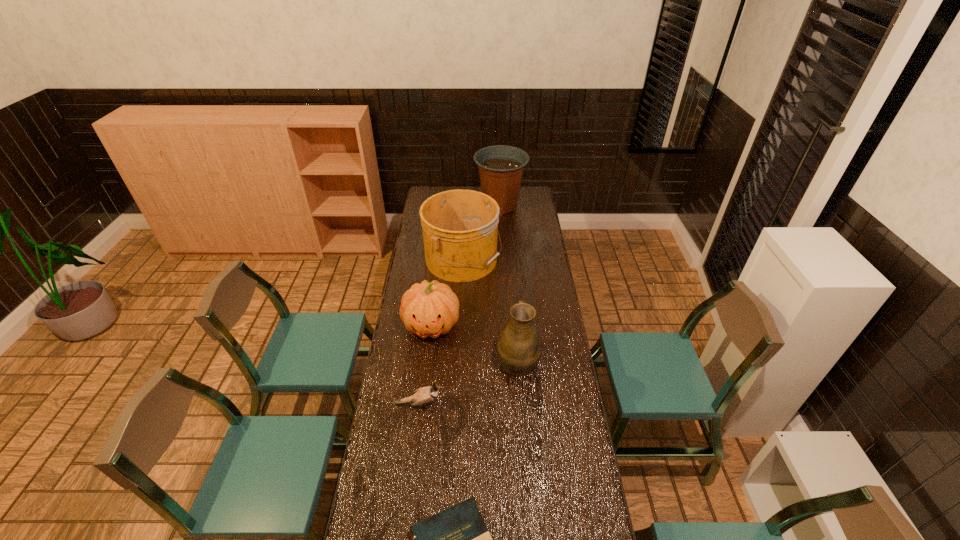
Image resolution: width=960 pixels, height=540 pixels. In order to click on vacant point at the left edge in this screenshot , I will do `click(421, 239)`.

Identify the location of free spot at the right edge of the desktop. (519, 225).

You are a GUI agent. You are given a task and a screenshot of the screen. Output one action in this format:
    pyautogui.click(x=<x>, y=<y>)
    Task: Click on the empty space that is in between the pumpkin and the pitcher
    
    Given the screenshot: What is the action you would take?
    pyautogui.click(x=475, y=343)

Find the location of `vacant space in between the bird and the pitcher`. vacant space in between the bird and the pitcher is located at coordinates (468, 382).

Identify which object is the closest to the pumpkin. Please provide its 2D coordinates. Your answer should be formatted as a tuple, i.e. [(x, y)], where the tuple contains the x and y coordinates of a point satisfying the conditions above.

[(460, 227)]

Where is `the second closest object to the second nearest object`? The width and height of the screenshot is (960, 540). the second closest object to the second nearest object is located at coordinates (428, 309).

Locate an element on the screen. Image resolution: width=960 pixels, height=540 pixels. free point that satisfies the following two spatial constraints: 1. on the carved face of the pumpkin; 2. at the face of the fifth tallest object is located at coordinates (422, 405).